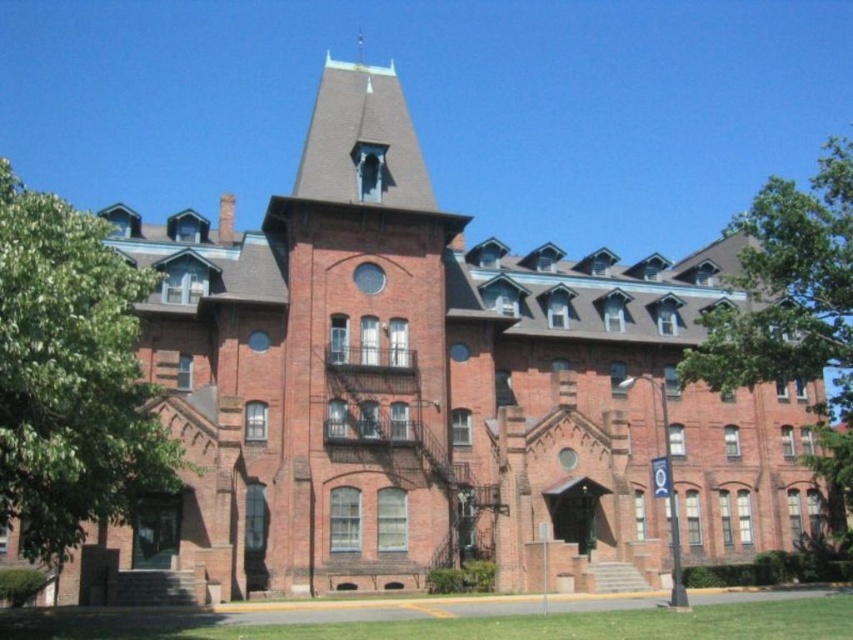
Question: Does green leafy tree at left have a larger size compared to green leafy tree at right?

Choices:
 (A) no
 (B) yes

Answer: (A)

Question: Is green leafy tree at left thinner than green leafy tree at right?

Choices:
 (A) no
 (B) yes

Answer: (B)

Question: Which point is closer to the camera taking this photo?

Choices:
 (A) (817, 426)
 (B) (146, 275)

Answer: (B)

Question: Is green leafy tree at left below green leafy tree at right?

Choices:
 (A) no
 (B) yes

Answer: (B)

Question: Among these objects, which one is nearest to the camera?

Choices:
 (A) green leafy tree at left
 (B) green leafy tree at right

Answer: (A)